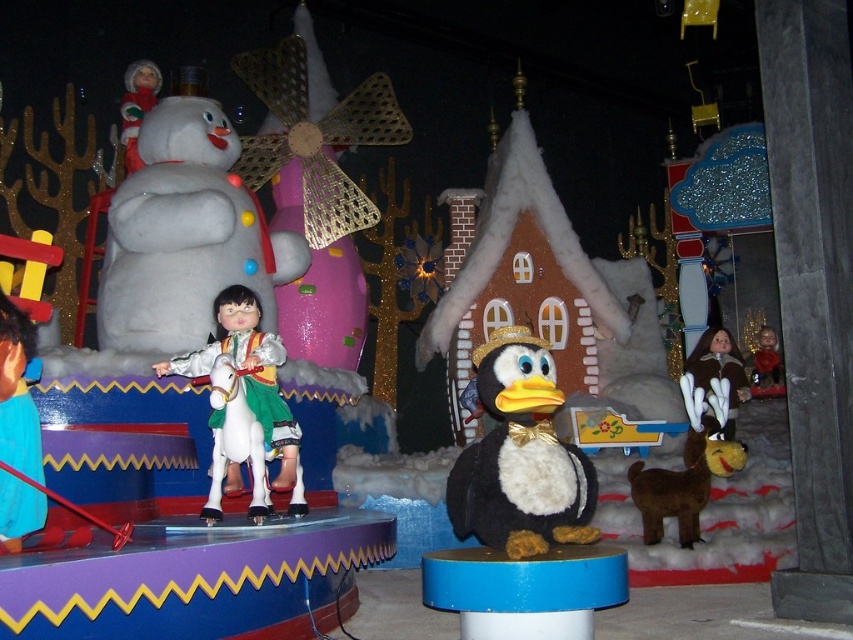
Question: Can you confirm if blue plastic stool at center is bigger than white glossy horse at center?

Choices:
 (A) yes
 (B) no

Answer: (B)

Question: Based on their relative distances, which object is nearer to the brown furry coat at right?

Choices:
 (A) matte plastic doll at upper left
 (B) blue plastic stool at center
 (C) smooth brown fur at center
 (D) black plush penguin at center

Answer: (C)

Question: Does matte plastic doll at upper left appear under smooth brown fur at center?

Choices:
 (A) no
 (B) yes

Answer: (A)

Question: Which point is farther to the camera?

Choices:
 (A) black plush penguin at center
 (B) matte plastic doll at upper left

Answer: (B)

Question: Is matte plastic doll at upper left bigger than smooth brown fur at center?

Choices:
 (A) yes
 (B) no

Answer: (A)

Question: Which object appears farthest from the camera in this image?

Choices:
 (A) smooth brown fur at center
 (B) blue plastic stool at center
 (C) matte plastic doll at upper left
 (D) brown furry coat at right

Answer: (A)